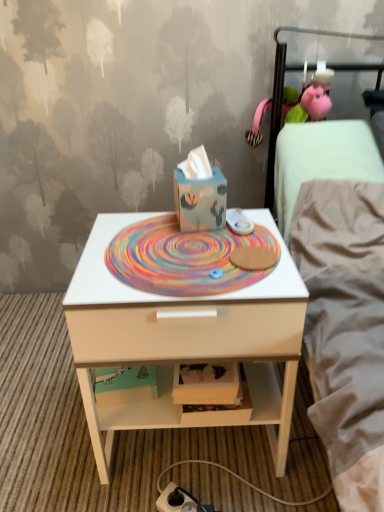
At what (x,y) coordinates should I click in order to perform the action: click on blank space above multicolored woven mat at center (from a real-world perspective). Please return your answer as a coordinate pair (x, y). This screenshot has width=384, height=512. Looking at the image, I should click on (202, 245).